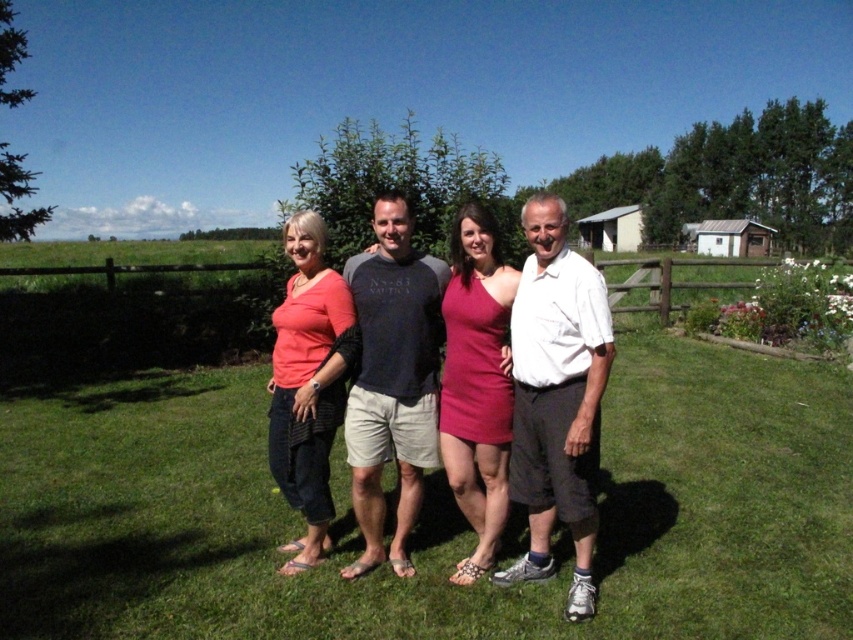
Describe the element at coordinates (432, 515) in the screenshot. I see `green grass at center` at that location.

Is green grass at center wider than dark gray cotton t-shirt at center?

Yes.

Which is behind, point (804, 586) or point (395, 209)?

The point (395, 209) is more distant.

Where is `green grass at center`? Image resolution: width=853 pixels, height=640 pixels. green grass at center is located at coordinates (432, 515).

Does white cotton shirt at center have a greater height compared to matte coral top at lower left?

Yes.

Can you confirm if white cotton shirt at center is bigger than matte coral top at lower left?

Yes, white cotton shirt at center is bigger than matte coral top at lower left.

This screenshot has height=640, width=853. Identify the location of white cotton shirt at center. (556, 397).

This screenshot has width=853, height=640. Find the location of `white cotton shirt at center`. white cotton shirt at center is located at coordinates (556, 397).

Who is higher up, green grass at center or white cotton shirt at center?

Positioned higher is white cotton shirt at center.

From the picture: Who is shorter, green grass at center or white cotton shirt at center?

green grass at center

Is point (457, 627) closer to viewer compared to point (602, 369)?

No, (457, 627) is further to viewer.

Identify the location of green grass at center. pos(432,515).